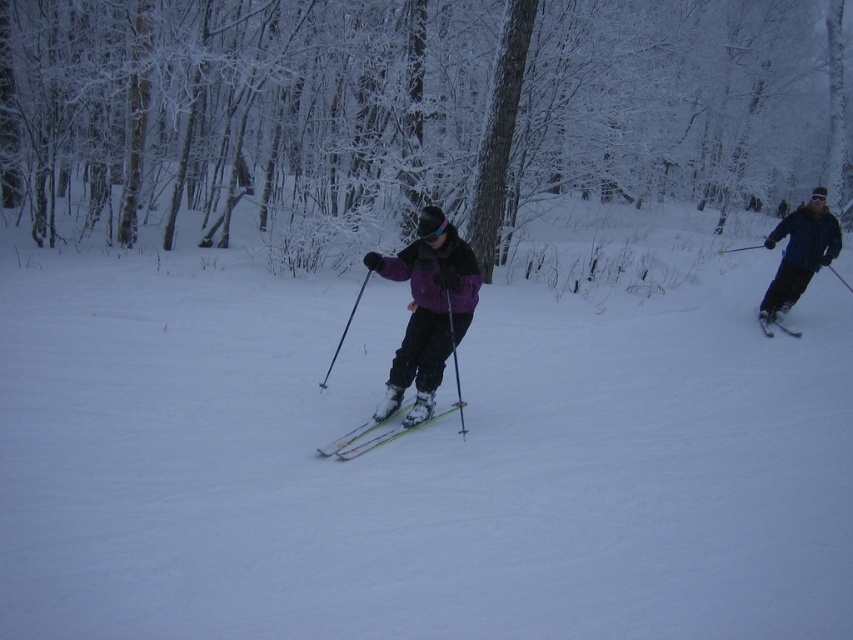
You are planning to build a snowman using the white snow ski slope at center and the snowy bark tree at center. Which object would be more suitable for the base of the snowman?

The white snow ski slope at center would be more suitable for the base of the snowman because it is not as tall as the snowy bark tree at center, making it a better foundation for stability.

What is the exact coordinate of the white snow ski slope at center?

The white snow ski slope at center is located at point (424, 451).

You are a skier planning to take a photo of the snowy bark tree at center. Your camera has a maximum focus range of 12 meters. Will you be able to focus on the tree?

The snowy bark tree at center is 13.02 meters from viewer, which exceeds the camera maximum focus range of 12 meters. So you cannot focus on the tree.